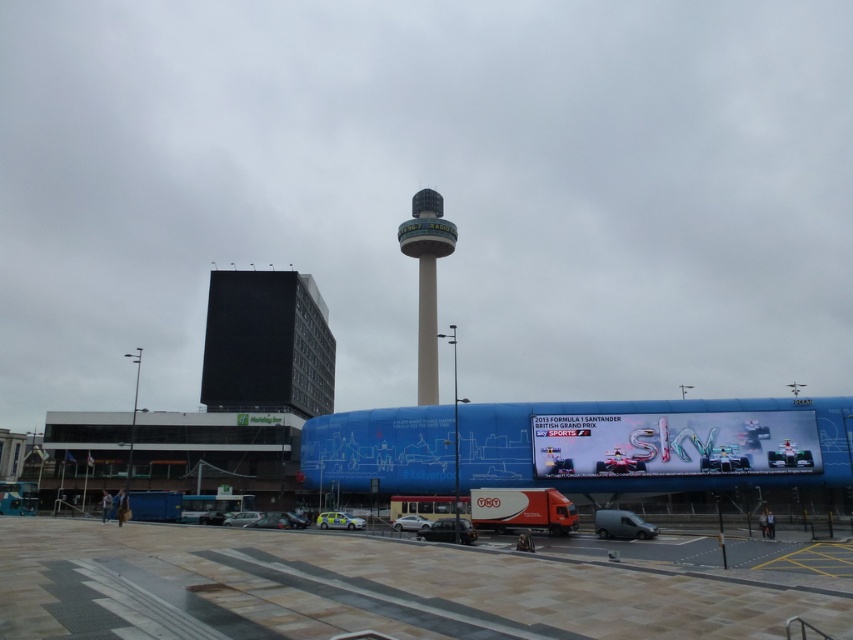
You are a city planner analyzing the urban layout. Given the paved stone tarmac at lower center and the black glass building at center, which one occupies a larger area in the image?

The black glass building at center occupies a larger area in the image compared to the paved stone tarmac at lower center, as the paved stone tarmac at lower center has a smaller size according to the description.

You are standing in the plaza and want to take a photo of the smooth concrete tower at center without the metallic blue billboard at center blocking the view. Is there a position where you can do this?

The metallic blue billboard at center is closer to the viewer than the smooth concrete tower at center. To avoid the billboard blocking the view, move to a position where the billboard is not between you and the tower. Since the billboard is closer, moving to the side or further back might allow you to frame the tower without the billboard obstructing it.